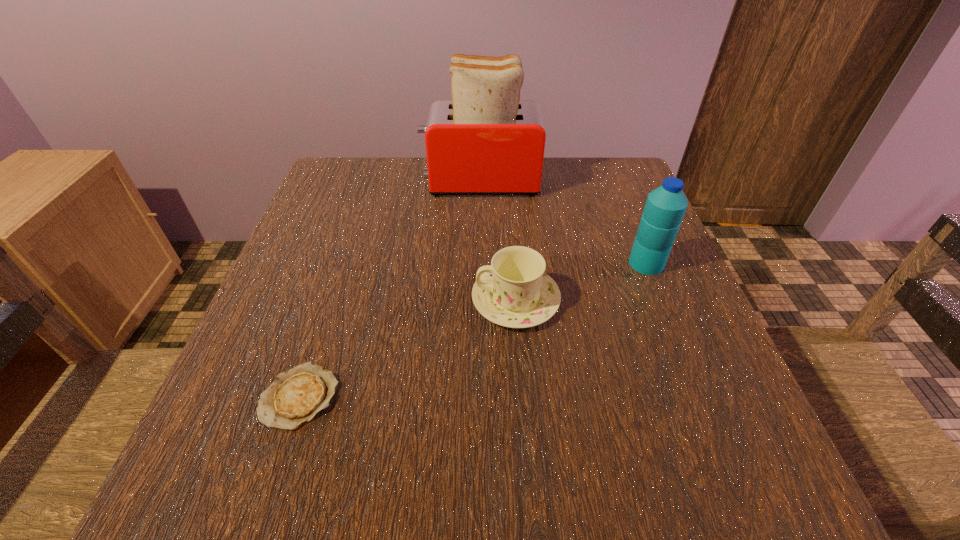
Where is `free area in between the toaster and the chinaware`? The height and width of the screenshot is (540, 960). free area in between the toaster and the chinaware is located at coordinates (498, 241).

At what (x,y) coordinates should I click in order to perform the action: click on free space that is in between the tallest object and the second shortest object. Please return your answer as a coordinate pair (x, y). The width and height of the screenshot is (960, 540). Looking at the image, I should click on (498, 241).

Where is `free space between the water bottle and the chinaware`? free space between the water bottle and the chinaware is located at coordinates (581, 282).

Image resolution: width=960 pixels, height=540 pixels. What are the coordinates of `vacant region between the water bottle and the third tallest object` in the screenshot? It's located at (581, 282).

Locate which object is the third closest to the third shortest object. Please provide its 2D coordinates. Your answer should be formatted as a tuple, i.e. [(x, y)], where the tuple contains the x and y coordinates of a point satisfying the conditions above.

[(296, 396)]

Locate an element on the screen. This screenshot has width=960, height=540. object that stands as the second closest to the third tallest object is located at coordinates (296, 396).

Identify the location of vacant space that satisfies the following two spatial constraints: 1. on the back side of the shortest object; 2. on the right side of the third shortest object. The height and width of the screenshot is (540, 960). (344, 264).

At what (x,y) coordinates should I click in order to perform the action: click on free space that satisfies the following two spatial constraints: 1. on the front-facing side of the toaster; 2. on the front side of the shortest object. Please return your answer as a coordinate pair (x, y). The image size is (960, 540). Looking at the image, I should click on (480, 396).

Where is `free space that satisfies the following two spatial constraints: 1. on the back side of the quiche; 2. on the left side of the rightmost object`? This screenshot has height=540, width=960. free space that satisfies the following two spatial constraints: 1. on the back side of the quiche; 2. on the left side of the rightmost object is located at coordinates (344, 264).

The height and width of the screenshot is (540, 960). I want to click on vacant space that satisfies the following two spatial constraints: 1. on the front-facing side of the farthest object; 2. on the front side of the nearest object, so click(x=480, y=396).